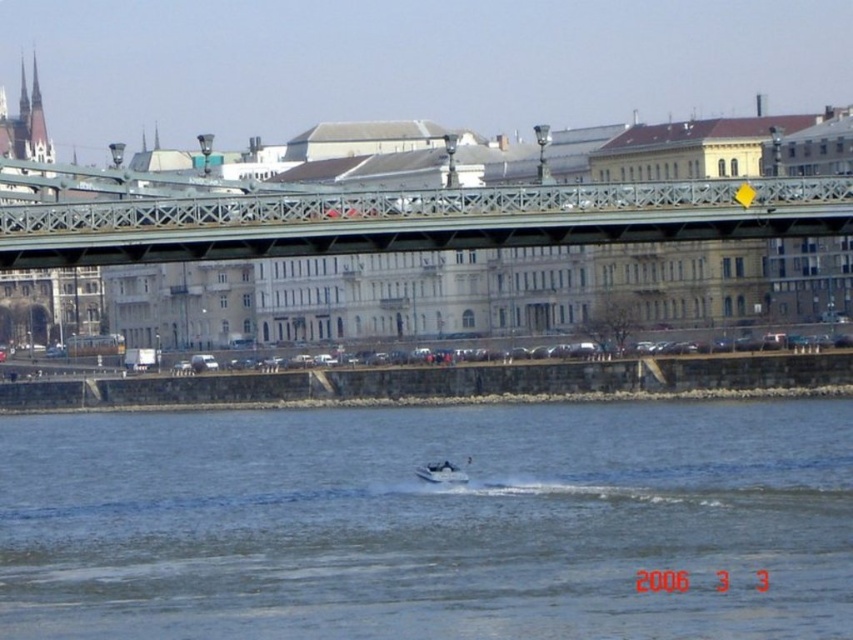
Question: Is metallic bridge at center closer to the viewer compared to white plastic boat at center?

Choices:
 (A) no
 (B) yes

Answer: (B)

Question: Does metallic bridge at center have a greater width compared to white plastic boat at center?

Choices:
 (A) yes
 (B) no

Answer: (A)

Question: Which object appears farthest from the camera in this image?

Choices:
 (A) white plastic boat at center
 (B) metallic bridge at center
 (C) clear water at center

Answer: (A)

Question: Which of the following is the closest to the observer?

Choices:
 (A) (433, 472)
 (B) (410, 419)
 (C) (776, 227)

Answer: (C)

Question: Which point appears farthest from the camera in this image?

Choices:
 (A) (444, 467)
 (B) (276, 429)

Answer: (B)

Question: Where is metallic bridge at center located in relation to white plastic boat at center in the image?

Choices:
 (A) left
 (B) right

Answer: (B)